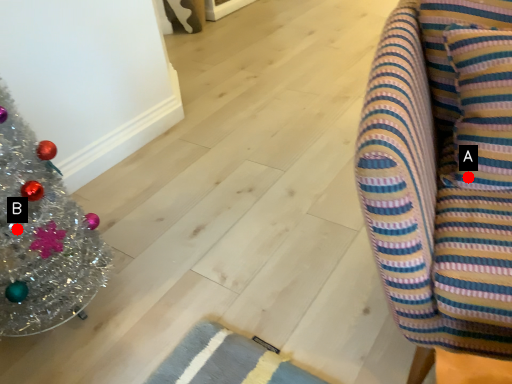
Question: Two points are circled on the image, labeled by A and B beside each circle. Which point is farther to the camera?

Choices:
 (A) A is further
 (B) B is further

Answer: (B)